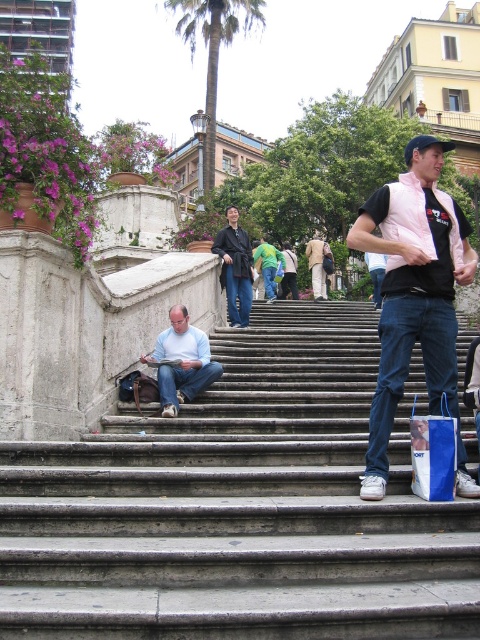
Does light blue cotton shirt at lower center have a larger size compared to light brown textured jacket at center?

No.

Is point (184, 371) less distant than point (310, 259)?

Yes, point (184, 371) is closer to viewer.

Image resolution: width=480 pixels, height=640 pixels. I want to click on light blue cotton shirt at lower center, so click(181, 362).

Describe the element at coordinates (213, 51) in the screenshot. I see `brown textured palm tree at upper center` at that location.

Is brown textured palm tree at upper center behind blue paper bag at lower right?

That is True.

Describe the element at coordinates (213, 51) in the screenshot. I see `brown textured palm tree at upper center` at that location.

Identify the location of brown textured palm tree at upper center. This screenshot has width=480, height=640. (213, 51).

Does smooth concrete stairs at center appear on the left side of light brown textured jacket at center?

Yes, smooth concrete stairs at center is to the left of light brown textured jacket at center.

Does smooth concrete stairs at center appear over light brown textured jacket at center?

No.

Between point (298, 307) and point (320, 285), which one is positioned behind?

Positioned behind is point (320, 285).

Locate an element on the screen. The height and width of the screenshot is (640, 480). smooth concrete stairs at center is located at coordinates (240, 508).